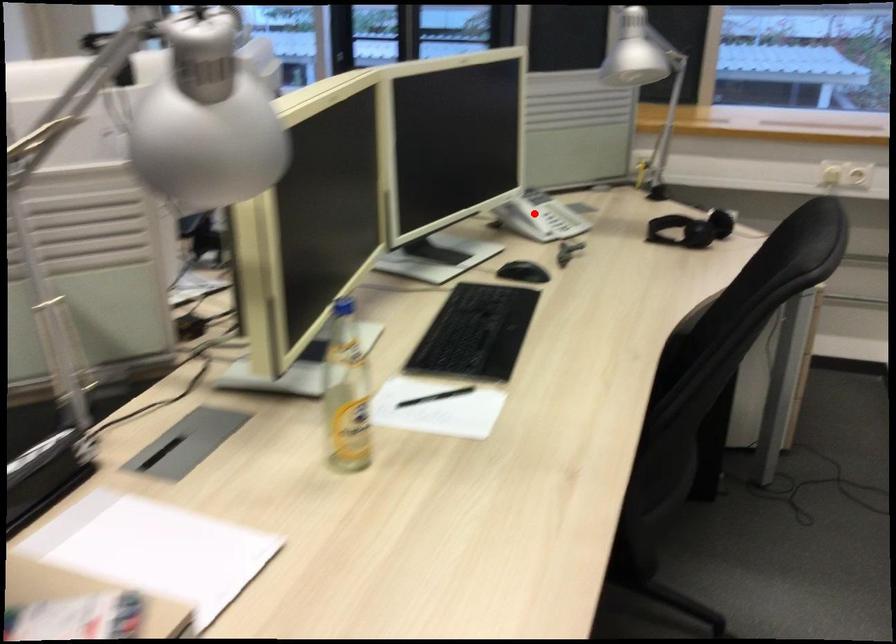
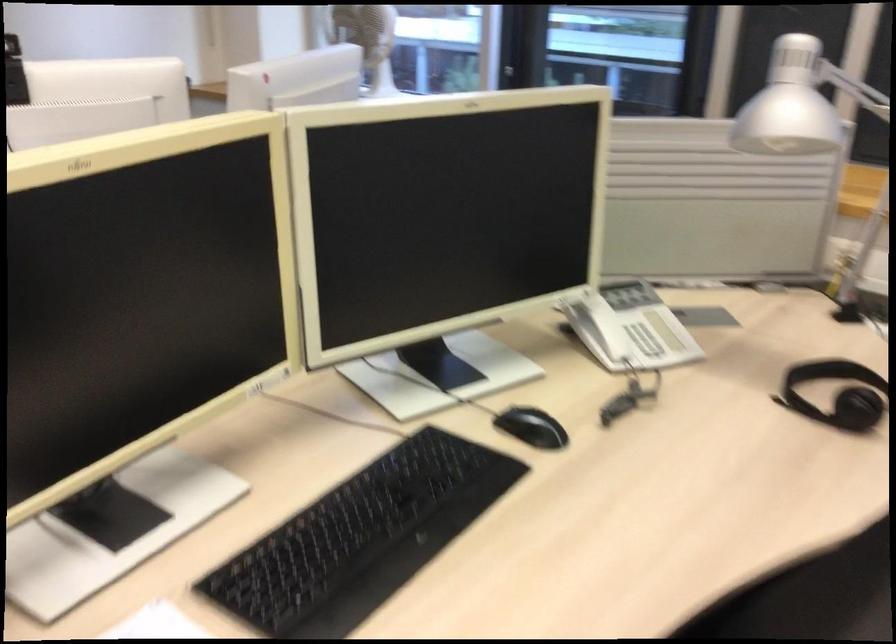
In the second image, find the point that corresponds to the highlighted location in the first image.

(604, 327)